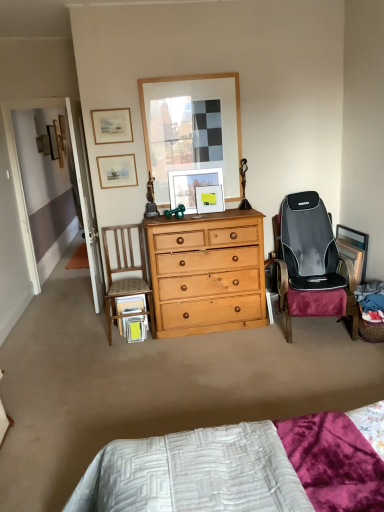
What do you see at coordinates (62, 126) in the screenshot? I see `wooden picture frame at upper left, placed as the seventh picture frame when sorted from right to left` at bounding box center [62, 126].

The height and width of the screenshot is (512, 384). I want to click on matte wooden picture frame at upper left, which appears as the 3th picture frame when viewed from the left, so click(x=112, y=126).

Image resolution: width=384 pixels, height=512 pixels. What do you see at coordinates (112, 126) in the screenshot? I see `matte wooden picture frame at upper left, the 5th picture frame positioned from the bottom` at bounding box center [112, 126].

The width and height of the screenshot is (384, 512). Describe the element at coordinates (53, 142) in the screenshot. I see `wooden picture frame at upper left, the 2th picture frame from the top` at that location.

Identify the location of matte wooden picture frame at upper left, acting as the fourth picture frame starting from the right. The image size is (384, 512). (117, 170).

Measure the distance between point (179, 201) and camera.

Point (179, 201) is 3.70 meters from camera.

The width and height of the screenshot is (384, 512). What are the coordinates of `wooden picture frame at right, which is the 1th picture frame in bottom-to-top order` in the screenshot? It's located at (353, 252).

Which is behind, point (111, 318) or point (194, 185)?

The point (194, 185) is farther.

Between wooden chair with upholstered seat at left and matte wooden picture frame at center, which is counted as the third picture frame, starting from the right, which one has less height?

matte wooden picture frame at center, which is counted as the third picture frame, starting from the right, is shorter.

Is wooden chair with upholstered seat at left surrounding matte wooden picture frame at center, which is counted as the third picture frame, starting from the right?

That's incorrect, matte wooden picture frame at center, which is counted as the third picture frame, starting from the right, is not inside wooden chair with upholstered seat at left.

Based on the photo, considering the sizes of objects wooden chair with upholstered seat at left and matte wooden picture frame at center, positioned as the fourth picture frame in front-to-back order, in the image provided, who is thinner, wooden chair with upholstered seat at left or matte wooden picture frame at center, positioned as the fourth picture frame in front-to-back order,?

matte wooden picture frame at center, positioned as the fourth picture frame in front-to-back order, is thinner.

Does point (129, 119) come behind point (340, 226)?

No, it is not.

Considering the sizes of matte wooden picture frame at upper left, acting as the 6th picture frame starting from the back, and wooden picture frame at right, which is the 1th picture frame in bottom-to-top order, in the image, is matte wooden picture frame at upper left, acting as the 6th picture frame starting from the back, wider or thinner than wooden picture frame at right, which is the 1th picture frame in bottom-to-top order,?

Clearly, matte wooden picture frame at upper left, acting as the 6th picture frame starting from the back, has less width compared to wooden picture frame at right, which is the 1th picture frame in bottom-to-top order.

Between matte wooden picture frame at upper left, the 5th picture frame positioned from the bottom, and wooden picture frame at right, which appears as the 1th picture frame when viewed from the front, which one is positioned behind?

matte wooden picture frame at upper left, the 5th picture frame positioned from the bottom.

Would you say matte wooden picture frame at upper left, acting as the 6th picture frame starting from the back, is inside or outside wooden picture frame at right, which appears as the 1th picture frame when viewed from the front?

matte wooden picture frame at upper left, acting as the 6th picture frame starting from the back, is not inside wooden picture frame at right, which appears as the 1th picture frame when viewed from the front, it's outside.

How distant is wooden chair with upholstered seat at left from matte wooden picture frame at upper left, which ranks as the fourth picture frame in bottom-to-top order?

A distance of 26.50 inches exists between wooden chair with upholstered seat at left and matte wooden picture frame at upper left, which ranks as the fourth picture frame in bottom-to-top order.

Is wooden chair with upholstered seat at left turned away from matte wooden picture frame at upper left, acting as the fourth picture frame starting from the right?

No, wooden chair with upholstered seat at left is not facing away from matte wooden picture frame at upper left, acting as the fourth picture frame starting from the right.

Who is smaller, wooden chair with upholstered seat at left or matte wooden picture frame at upper left, the third picture frame from the front?

matte wooden picture frame at upper left, the third picture frame from the front.

Are wooden chair with upholstered seat at left and matte wooden picture frame at upper left, arranged as the fourth picture frame when viewed from the left, beside each other?

No.

Measure the distance between wooden picture frame at upper left, which is the second picture frame in left-to-right order, and wooden picture frame at right, which appears as the 1th picture frame when viewed from the right.

wooden picture frame at upper left, which is the second picture frame in left-to-right order, is 13.53 feet away from wooden picture frame at right, which appears as the 1th picture frame when viewed from the right.

Could you tell me if wooden picture frame at upper left, arranged as the sixth picture frame when ordered from the bottom, is turned towards wooden picture frame at right, which appears as the 7th picture frame when viewed from the top?

No, wooden picture frame at upper left, arranged as the sixth picture frame when ordered from the bottom, is not aimed at wooden picture frame at right, which appears as the 7th picture frame when viewed from the top.

Which object is thinner, wooden picture frame at upper left, the 6th picture frame when ordered from front to back, or wooden picture frame at right, positioned as the 7th picture frame in left-to-right order?

wooden picture frame at upper left, the 6th picture frame when ordered from front to back, is thinner.

How different are the orientations of wooden picture frame at upper left, the 2th picture frame from the top, and wooden picture frame at right, the seventh picture frame when ordered from back to front, in degrees?

The angle between the facing direction of wooden picture frame at upper left, the 2th picture frame from the top, and the facing direction of wooden picture frame at right, the seventh picture frame when ordered from back to front, is 90.7 degrees.

Can you confirm if matte wooden picture frame at upper left, acting as the fourth picture frame starting from the right, is smaller than matte wooden picture frame at upper left, the 5th picture frame positioned from the bottom?

Incorrect, matte wooden picture frame at upper left, acting as the fourth picture frame starting from the right, is not smaller in size than matte wooden picture frame at upper left, the 5th picture frame positioned from the bottom.

Measure the distance between matte wooden picture frame at upper left, acting as the fourth picture frame starting from the right, and matte wooden picture frame at upper left, acting as the 6th picture frame starting from the back.

9.61 inches.

Identify the location of picture frame that is the 1st object to the left of the matte wooden picture frame at upper left, which is the fourth picture frame in top-to-bottom order, starting at the anchor. This screenshot has height=512, width=384. [112, 126].

Based on the photo, could you tell me if matte wooden picture frame at upper left, acting as the fourth picture frame starting from the right, is facing matte wooden picture frame at upper left, the 5th picture frame positioned from the bottom?

No, matte wooden picture frame at upper left, acting as the fourth picture frame starting from the right, is not facing towards matte wooden picture frame at upper left, the 5th picture frame positioned from the bottom.

From a real-world perspective, which object rests below the other?

wooden picture frame at right, which appears as the 1th picture frame when viewed from the right.

From the image's perspective, is matte wooden picture frame at center, which ranks as the fourth picture frame in back-to-front order, beneath wooden picture frame at right, which is the 1th picture frame in bottom-to-top order?

No, from the image's perspective, matte wooden picture frame at center, which ranks as the fourth picture frame in back-to-front order, is not beneath wooden picture frame at right, which is the 1th picture frame in bottom-to-top order.

Could you tell me if matte wooden picture frame at center, which appears as the 5th picture frame when viewed from the top, is turned towards wooden picture frame at right, which appears as the 1th picture frame when viewed from the right?

No, matte wooden picture frame at center, which appears as the 5th picture frame when viewed from the top, is not oriented towards wooden picture frame at right, which appears as the 1th picture frame when viewed from the right.

How far apart are matte wooden picture frame at center, positioned as the fourth picture frame in front-to-back order, and wooden picture frame at right, which appears as the 1th picture frame when viewed from the right?

matte wooden picture frame at center, positioned as the fourth picture frame in front-to-back order, and wooden picture frame at right, which appears as the 1th picture frame when viewed from the right, are 1.32 meters apart from each other.

How far apart are matte wooden picture frame at center, the second picture frame viewed from the right, and wooden picture frame at right, which appears as the 1th picture frame when viewed from the front?

The distance of matte wooden picture frame at center, the second picture frame viewed from the right, from wooden picture frame at right, which appears as the 1th picture frame when viewed from the front, is 3.88 feet.

Which of these two, matte wooden picture frame at center, the sixth picture frame when ordered from top to bottom, or wooden picture frame at right, positioned as the 7th picture frame in left-to-right order, is thinner?

With smaller width is matte wooden picture frame at center, the sixth picture frame when ordered from top to bottom.

Could wooden picture frame at right, which is the 1th picture frame in bottom-to-top order, be considered to be inside matte wooden picture frame at center, the second picture frame positioned from the bottom?

Actually, wooden picture frame at right, which is the 1th picture frame in bottom-to-top order, is outside matte wooden picture frame at center, the second picture frame positioned from the bottom.

Is matte wooden picture frame at center, marked as the fifth picture frame in a front-to-back arrangement, beside wooden picture frame at right, the seventh picture frame when ordered from back to front?

There is a gap between matte wooden picture frame at center, marked as the fifth picture frame in a front-to-back arrangement, and wooden picture frame at right, the seventh picture frame when ordered from back to front.

You are a GUI agent. You are given a task and a screenshot of the screen. Output one action in this format:
    pyautogui.click(x=<x>, y=<y>)
    Task: Click on the chair located on the left of matte wooden picture frame at center, which appears as the 5th picture frame when viewed from the top
    
    Given the screenshot: What is the action you would take?
    click(128, 277)

Which picture frame is the 4th one when counting from the right side of the matte wooden picture frame at upper left, placed as the 2th picture frame when sorted from front to back? Please provide its 2D coordinates.

[(353, 252)]

Looking at the image, which one is located closer to matte wooden picture frame at center, marked as the third picture frame in a bottom-to-top arrangement, wooden picture frame at upper left, acting as the 1th picture frame starting from the top, or wooden picture frame at right, which is the 1th picture frame in bottom-to-top order?

The object closer to matte wooden picture frame at center, marked as the third picture frame in a bottom-to-top arrangement, is wooden picture frame at right, which is the 1th picture frame in bottom-to-top order.

Looking at the image, which one is located further to matte wooden picture frame at upper left, which is counted as the fifth picture frame, starting from the right, matte wooden picture frame at center, which is counted as the third picture frame, starting from the right, or matte wooden picture frame at upper left, the third picture frame from the front?

matte wooden picture frame at center, which is counted as the third picture frame, starting from the right.

Estimate the real-world distances between objects in this image. Which object is further from wooden chair with upholstered seat at left, matte wooden picture frame at upper left, arranged as the fourth picture frame when viewed from the left, or wooden picture frame at right, the seventh picture frame when ordered from back to front?

The object further to wooden chair with upholstered seat at left is wooden picture frame at right, the seventh picture frame when ordered from back to front.

Which object lies nearer to the anchor point wooden picture frame at right, positioned as the 7th picture frame in left-to-right order, matte wooden picture frame at upper left, which is counted as the 3th picture frame, starting from the top, or wooden picture frame at upper left, which appears as the 1th picture frame when viewed from the back?

matte wooden picture frame at upper left, which is counted as the 3th picture frame, starting from the top, is positioned closer to the anchor wooden picture frame at right, positioned as the 7th picture frame in left-to-right order.

Considering their positions, is wooden picture frame at upper left, which is the 7th picture frame in bottom-to-top order, positioned closer to wooden chair with upholstered seat at left than wooden picture frame at right, which appears as the 1th picture frame when viewed from the front?

Based on the image, wooden picture frame at right, which appears as the 1th picture frame when viewed from the front, appears to be nearer to wooden chair with upholstered seat at left.

From the picture: When comparing their distances from wooden picture frame at right, which appears as the 1th picture frame when viewed from the front, does matte wooden picture frame at center, the sixth picture frame when ordered from top to bottom, or matte wooden picture frame at upper left, which is counted as the 3th picture frame, starting from the top, seem further?

matte wooden picture frame at upper left, which is counted as the 3th picture frame, starting from the top, is further to wooden picture frame at right, which appears as the 1th picture frame when viewed from the front.

When comparing their distances from wooden picture frame at upper left, which appears as the 1th picture frame when viewed from the back, does matte wooden picture frame at center, positioned as the fourth picture frame in front-to-back order, or wooden picture frame at right, which appears as the 1th picture frame when viewed from the right, seem further?

The object further to wooden picture frame at upper left, which appears as the 1th picture frame when viewed from the back, is wooden picture frame at right, which appears as the 1th picture frame when viewed from the right.

When comparing their distances from matte wooden picture frame at upper left, acting as the 6th picture frame starting from the back, does matte wooden picture frame at center, marked as the fifth picture frame in a front-to-back arrangement, or wooden picture frame at upper left, acting as the second picture frame starting from the back, seem further?

wooden picture frame at upper left, acting as the second picture frame starting from the back, lies further to matte wooden picture frame at upper left, acting as the 6th picture frame starting from the back, than the other object.

Find the location of a particular element. The image size is (384, 512). chair located between wooden picture frame at upper left, acting as the second picture frame starting from the back, and wooden picture frame at right, the seventh picture frame when ordered from back to front, in the left-right direction is located at coordinates (128, 277).

Image resolution: width=384 pixels, height=512 pixels. In order to click on chair located between matte wooden picture frame at upper left, arranged as the fourth picture frame when viewed from the left, and wooden picture frame at right, which is the 1th picture frame in bottom-to-top order, in the left-right direction in this screenshot , I will do `click(128, 277)`.

At what (x,y) coordinates should I click in order to perform the action: click on picture frame between matte wooden picture frame at center, positioned as the fourth picture frame in front-to-back order, and wooden picture frame at right, which appears as the 1th picture frame when viewed from the front. Please return your answer as a coordinate pair (x, y). Looking at the image, I should click on (209, 199).

The image size is (384, 512). In order to click on picture frame located between matte wooden picture frame at upper left, arranged as the fourth picture frame when viewed from the left, and matte wooden picture frame at center, which appears as the 3th picture frame when viewed from the back, in the left-right direction in this screenshot , I will do `click(192, 186)`.